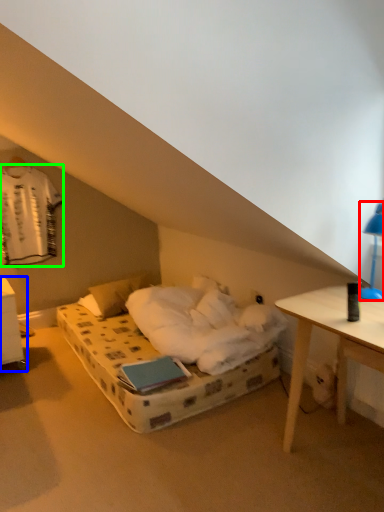
Question: Considering the real-world distances, which object is closest to bedside lamp (highlighted by a red box)? nightstand (highlighted by a blue box) or laundry (highlighted by a green box).

Choices:
 (A) nightstand
 (B) laundry

Answer: (A)